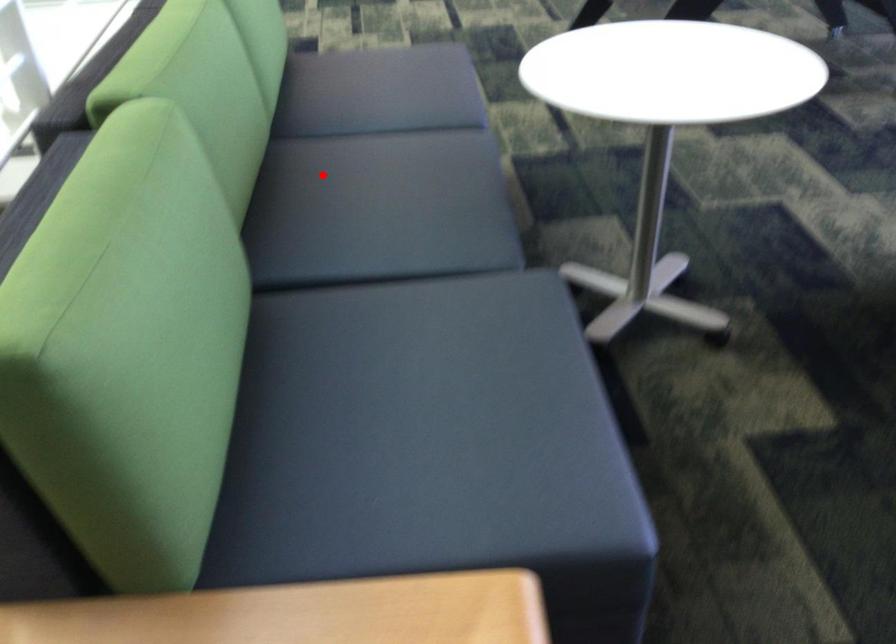
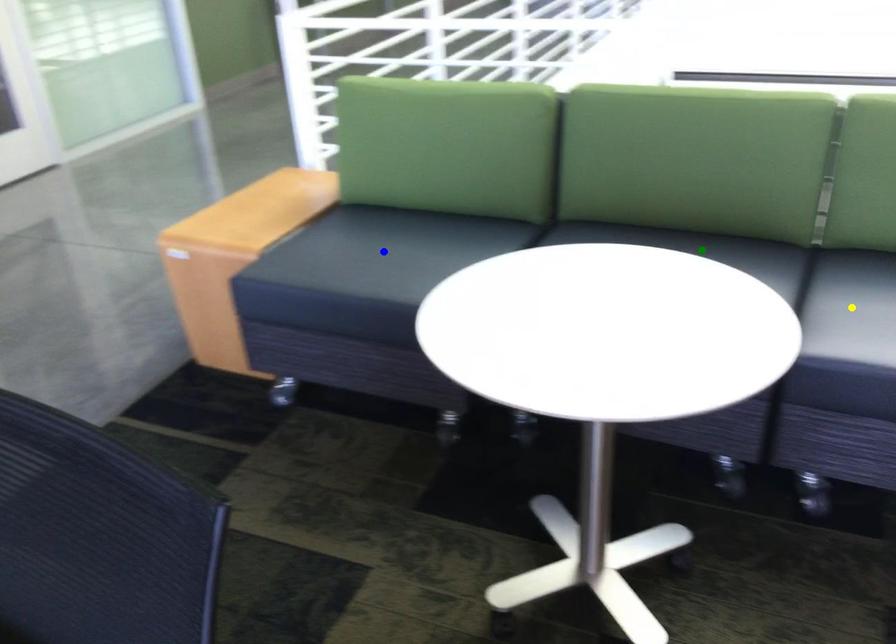
Question: I am providing you with two images of the same scene from different viewpoints. A red point is marked on the first image. You are given multiple points on the second image. Can you choose the point in image 2 that corresponds to the point in image 1?

Choices:
 (A) green point
 (B) yellow point
 (C) blue point

Answer: (A)